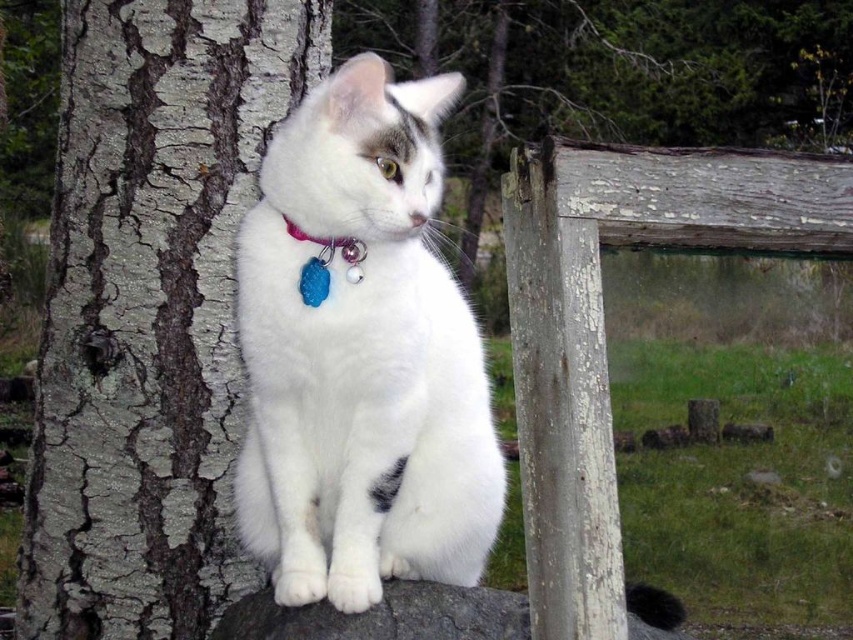
Is gray rough bark tree trunk at left smaller than white fluffy cat at center?

Yes.

Between gray rough bark tree trunk at left and white fluffy cat at center, which one has less height?

white fluffy cat at center is shorter.

Image resolution: width=853 pixels, height=640 pixels. I want to click on gray rough bark tree trunk at left, so click(149, 308).

At what (x,y) coordinates should I click in order to perform the action: click on gray rough bark tree trunk at left. Please return your answer as a coordinate pair (x, y). This screenshot has width=853, height=640. Looking at the image, I should click on (149, 308).

Can you confirm if white fluffy cat at center is smaller than weathered wood fence at right?

No, white fluffy cat at center is not smaller than weathered wood fence at right.

Does white fluffy cat at center appear on the left side of weathered wood fence at right?

Indeed, white fluffy cat at center is positioned on the left side of weathered wood fence at right.

The image size is (853, 640). What do you see at coordinates (361, 356) in the screenshot?
I see `white fluffy cat at center` at bounding box center [361, 356].

You are a GUI agent. You are given a task and a screenshot of the screen. Output one action in this format:
    pyautogui.click(x=<x>, y=<y>)
    Task: Click on the white fluffy cat at center
    
    Given the screenshot: What is the action you would take?
    pyautogui.click(x=361, y=356)

Which is below, gray rough bark tree trunk at left or weathered wood fence at right?

weathered wood fence at right

Between gray rough bark tree trunk at left and weathered wood fence at right, which one appears on the right side from the viewer's perspective?

weathered wood fence at right

At what (x,y) coordinates should I click in order to perform the action: click on gray rough bark tree trunk at left. Please return your answer as a coordinate pair (x, y). The width and height of the screenshot is (853, 640). Looking at the image, I should click on (149, 308).